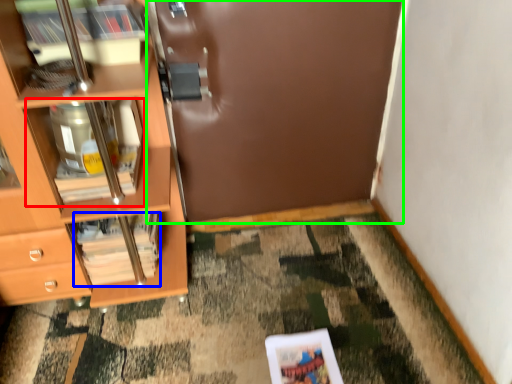
Question: Which is farther away from cabinet (highlighted by a red box)? magazine (highlighted by a blue box) or door (highlighted by a green box)?

Choices:
 (A) magazine
 (B) door

Answer: (B)